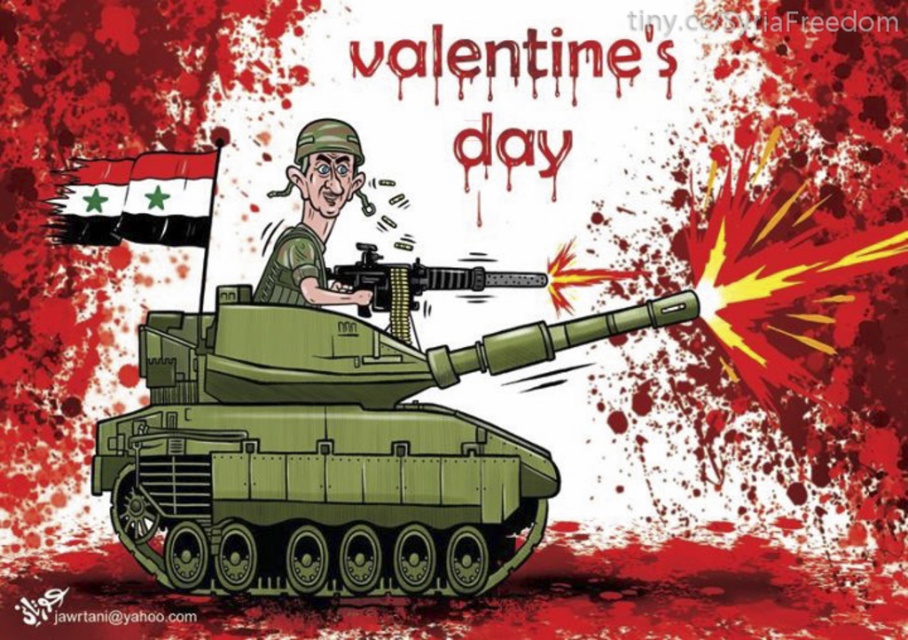
Can you confirm if black fabric flag at upper left is shorter than black matte machine gun at center?

No, black fabric flag at upper left is not shorter than black matte machine gun at center.

Image resolution: width=908 pixels, height=640 pixels. What do you see at coordinates (135, 198) in the screenshot? I see `black fabric flag at upper left` at bounding box center [135, 198].

Where is `black fabric flag at upper left`? The height and width of the screenshot is (640, 908). black fabric flag at upper left is located at coordinates (135, 198).

Can you confirm if green matte tank at center is shorter than matte green uniform at center?

Incorrect, green matte tank at center's height does not fall short of matte green uniform at center's.

Is point (574, 333) farther from camera compared to point (311, 198)?

No, (574, 333) is in front of (311, 198).

This screenshot has height=640, width=908. I want to click on green matte tank at center, so pos(329,452).

Between green matte tank at center and black fabric flag at upper left, which one appears on the left side from the viewer's perspective?

black fabric flag at upper left is more to the left.

The image size is (908, 640). Describe the element at coordinates (329, 452) in the screenshot. I see `green matte tank at center` at that location.

The height and width of the screenshot is (640, 908). What do you see at coordinates (329, 452) in the screenshot?
I see `green matte tank at center` at bounding box center [329, 452].

At what (x,y) coordinates should I click in order to perform the action: click on green matte tank at center. Please return your answer as a coordinate pair (x, y). The width and height of the screenshot is (908, 640). Looking at the image, I should click on (329, 452).